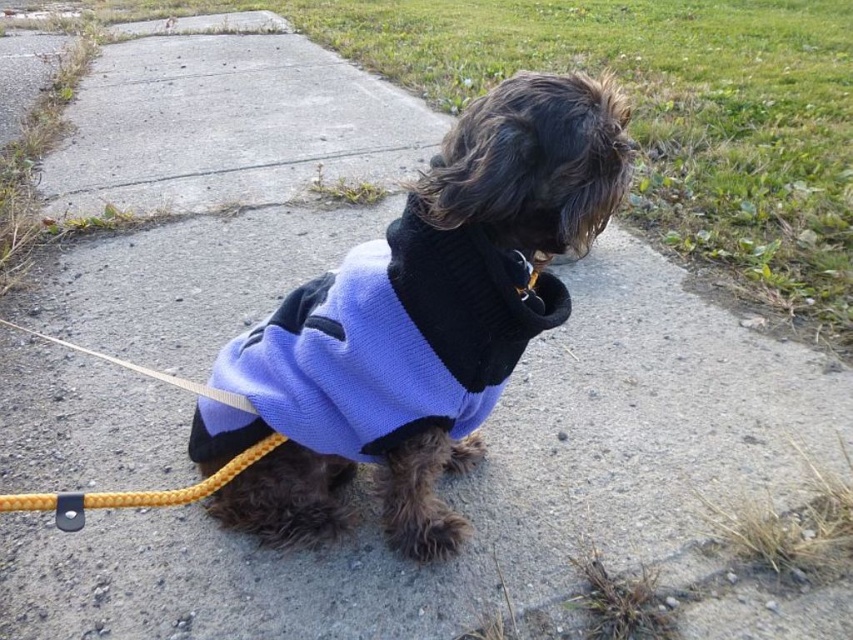
Question: Is knitted blue sweater at center positioned at the back of yellow braided rope leash at lower left?

Choices:
 (A) no
 (B) yes

Answer: (A)

Question: Which point is farther to the camera?

Choices:
 (A) knitted blue sweater at center
 (B) yellow braided rope leash at lower left

Answer: (B)

Question: Which point is farther from the camera taking this photo?

Choices:
 (A) (148, 371)
 (B) (503, 141)

Answer: (A)

Question: Is knitted blue sweater at center to the right of yellow braided rope leash at lower left from the viewer's perspective?

Choices:
 (A) no
 (B) yes

Answer: (B)

Question: Observing the image, what is the correct spatial positioning of knitted blue sweater at center in reference to yellow braided rope leash at lower left?

Choices:
 (A) left
 (B) right

Answer: (B)

Question: Which point is farther to the camera?

Choices:
 (A) (456, 257)
 (B) (225, 392)

Answer: (B)